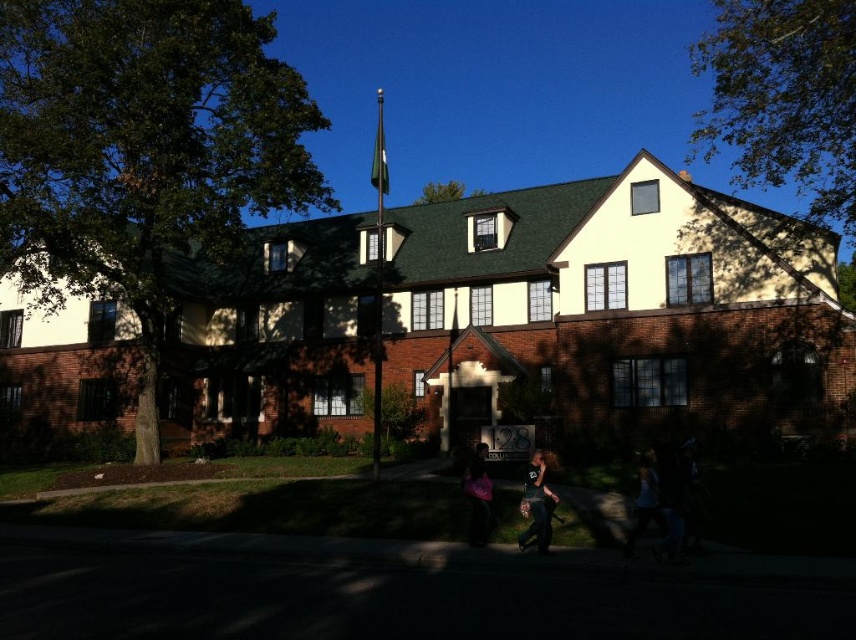
Based on the photo, is matte black shirt at center above white tank top at lower right?

Indeed, matte black shirt at center is positioned over white tank top at lower right.

Can you confirm if matte black shirt at center is bigger than white tank top at lower right?

Actually, matte black shirt at center might be smaller than white tank top at lower right.

Is point (535, 541) more distant than point (657, 484)?

That is True.

The image size is (856, 640). I want to click on matte black shirt at center, so click(536, 506).

Who is higher up, white matte building at center or matte black shirt at center?

white matte building at center is higher up.

Who is more distant from viewer, (x=31, y=374) or (x=533, y=481)?

The point (x=31, y=374) is behind.

The height and width of the screenshot is (640, 856). What do you see at coordinates (614, 307) in the screenshot? I see `white matte building at center` at bounding box center [614, 307].

Locate an element on the screen. white matte building at center is located at coordinates (614, 307).

Which is more to the right, white matte building at center or white tank top at lower right?

white tank top at lower right is more to the right.

Which is behind, point (212, 349) or point (642, 456)?

The point (212, 349) is more distant.

Which is in front, point (685, 216) or point (631, 552)?

Point (631, 552) is more forward.

Find the location of a particular element. The image size is (856, 640). white matte building at center is located at coordinates (614, 307).